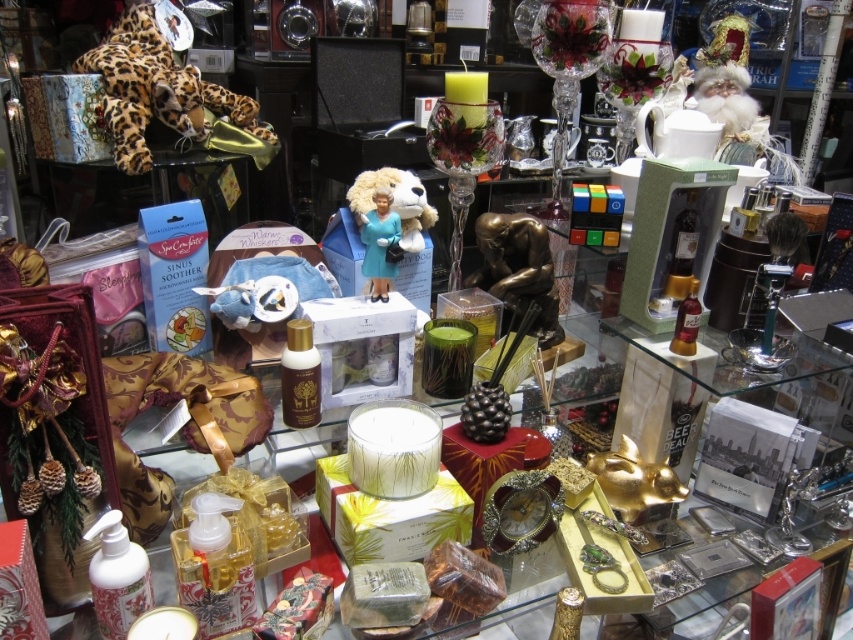
You are standing in front of the gift shop display and need to locate the leopard print plush at upper left. According to the coordinates provided, where exactly is it positioned?

The leopard print plush at upper left is located at point (155, 90).

You are trying to decide whether to place a new item on the shelf next to the leopard print plush at upper left and the blue glossy figurine at center. If the new item is 10 cm wide, which existing item should you compare its width to determine if there is enough space?

The leopard print plush at upper left might be wider than the blue glossy figurine at center, so you should compare the new item to the leopard print plush at upper left to ensure there is enough space.

You are organizing a store display and need to place a large decorative item on a shelf. You have the leopard print plush at upper left and the blue glossy figurine at center. Which item should you choose to ensure it fits on the shelf?

The leopard print plush at upper left is larger in size than the blue glossy figurine at center, so you should choose the leopard print plush at upper left to ensure it fits on the shelf if the shelf can accommodate larger items.